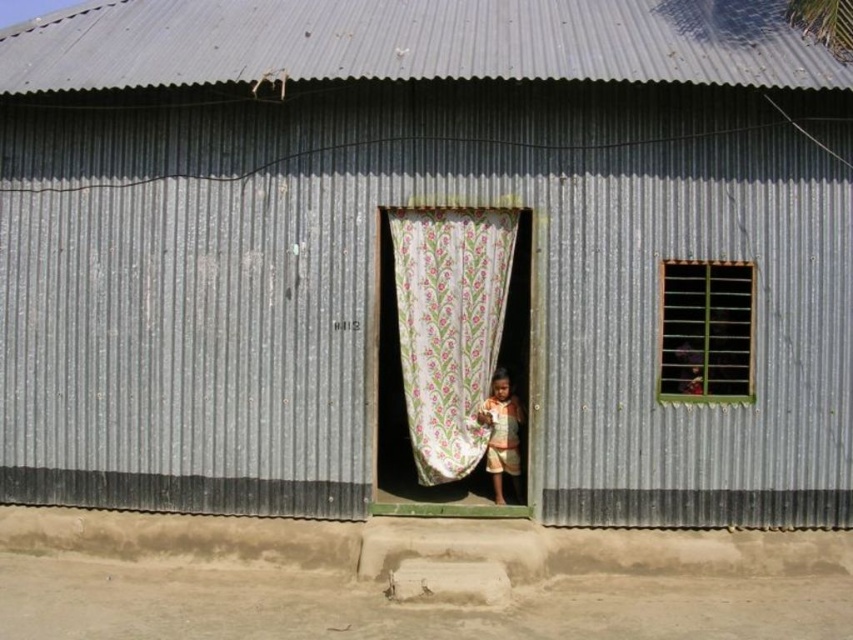
Question: Is floral-patterned fabric at center to the left of light brown fabric at door center from the viewer's perspective?

Choices:
 (A) no
 (B) yes

Answer: (B)

Question: Which object is positioned closest to the black metal bars at upper right?

Choices:
 (A) light brown fabric at door center
 (B) floral-patterned fabric at center

Answer: (A)

Question: Among these objects, which one is nearest to the camera?

Choices:
 (A) black metal bars at upper right
 (B) floral-patterned fabric at center

Answer: (A)

Question: Is black metal bars at upper right positioned in front of light brown fabric at door center?

Choices:
 (A) yes
 (B) no

Answer: (A)

Question: Which point is closer to the camera?

Choices:
 (A) (517, 477)
 (B) (670, 292)
 (C) (477, 326)

Answer: (B)

Question: Is black metal bars at upper right wider than light brown fabric at door center?

Choices:
 (A) no
 (B) yes

Answer: (B)